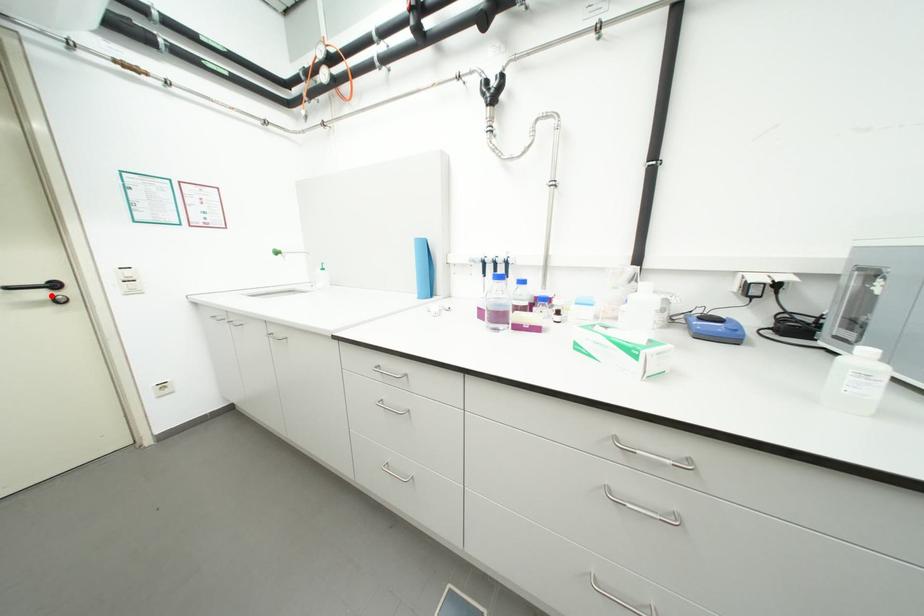
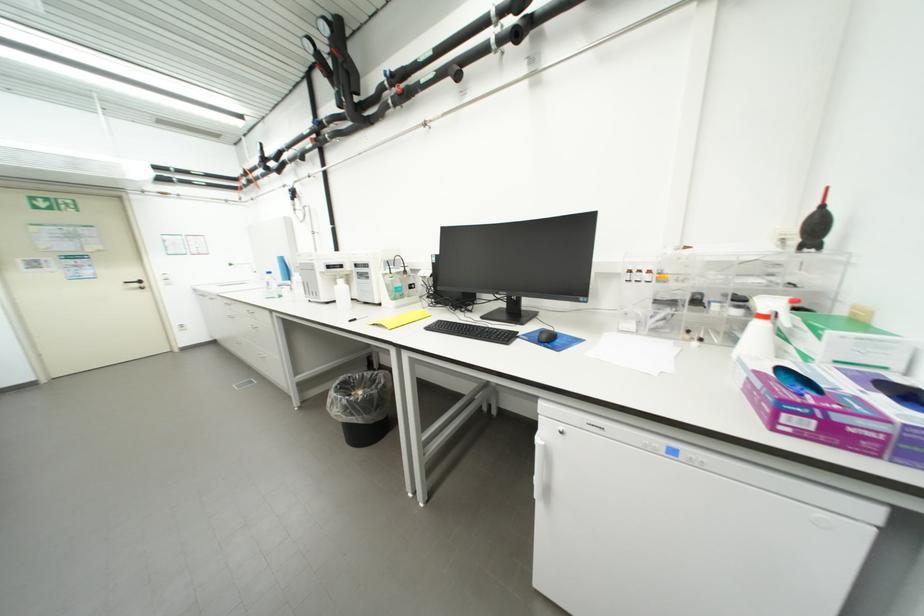
Question: A red point is marked in image1. In image2, is the corresponding 3D point closer to the camera or farther? Reply with the corresponding letter.

Choices:
 (A) The corresponding 3D point is closer.
 (B) The corresponding 3D point is farther.

Answer: (A)